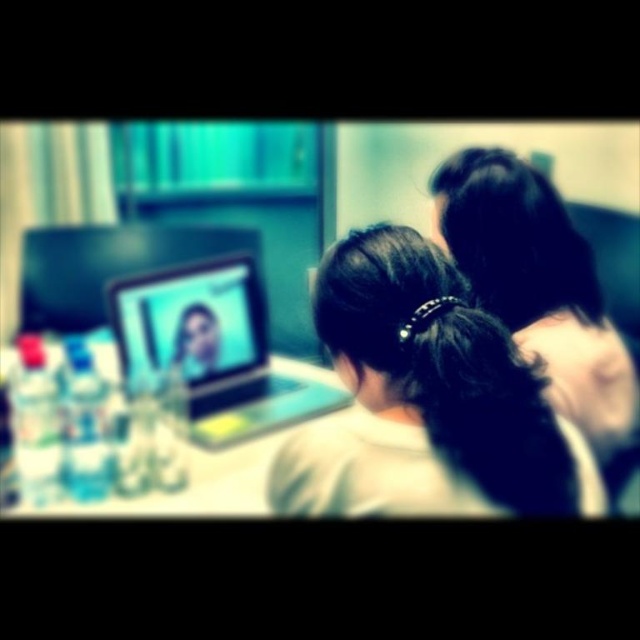
Question: Which of the following is the closest to the observer?

Choices:
 (A) (572, 502)
 (B) (244, 266)

Answer: (A)

Question: Among these objects, which one is farthest from the camera?

Choices:
 (A) dark brown hair at center
 (B) teal glossy laptop at center

Answer: (B)

Question: Does dark brown hair at center appear on the left side of teal glossy laptop at center?

Choices:
 (A) yes
 (B) no

Answer: (B)

Question: Can you confirm if dark brown hair at center is thinner than teal glossy laptop at center?

Choices:
 (A) no
 (B) yes

Answer: (B)

Question: Which point is closer to the camera taking this photo?

Choices:
 (A) (230, 404)
 (B) (452, 476)

Answer: (B)

Question: Observing the image, what is the correct spatial positioning of dark brown hair at center in reference to teal glossy laptop at center?

Choices:
 (A) right
 (B) left

Answer: (A)